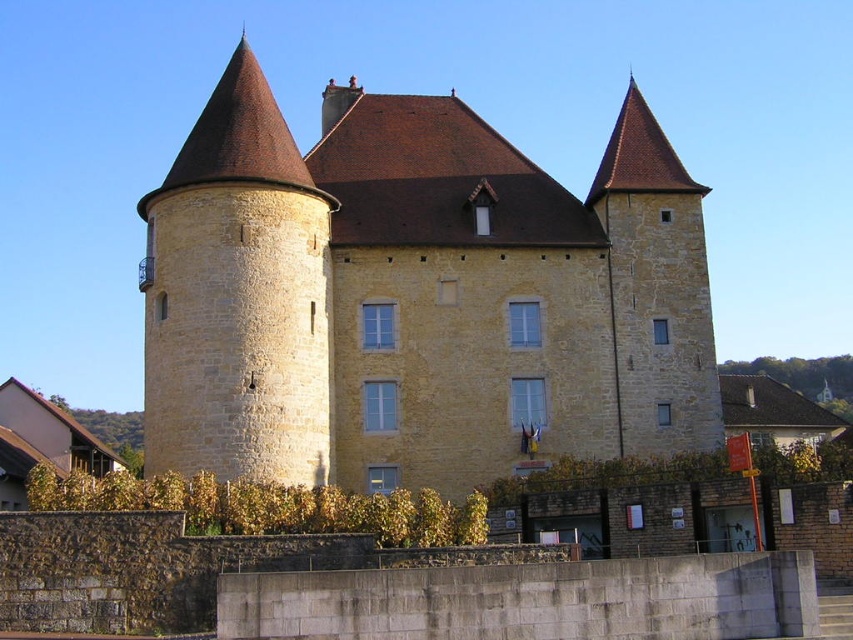
You are a tour guide leading a group around the historic site. You want to inform your visitors about the distance between the yellow stone castle at center and the yellow stone tower at left. What do you tell them?

The yellow stone castle at center is 4.88 meters away from the yellow stone tower at left.

You are standing in front of the historic stone building and want to take a photo that includes both the yellow stone castle at center and the yellow stone tower at left. Based on their positions, which one should you place on the left side of your photo to capture both properly?

The yellow stone tower at left should be placed on the left side of the photo since the yellow stone castle at center is positioned to its right, ensuring both are included in the frame.

In the scene shown: You are a tourist standing in front of the historic stone building. You see the yellow stone castle at center and the yellow stone tower at left. Which of these two structures is closer to you?

The yellow stone castle at center is closer to you because the yellow stone tower at left is behind it.